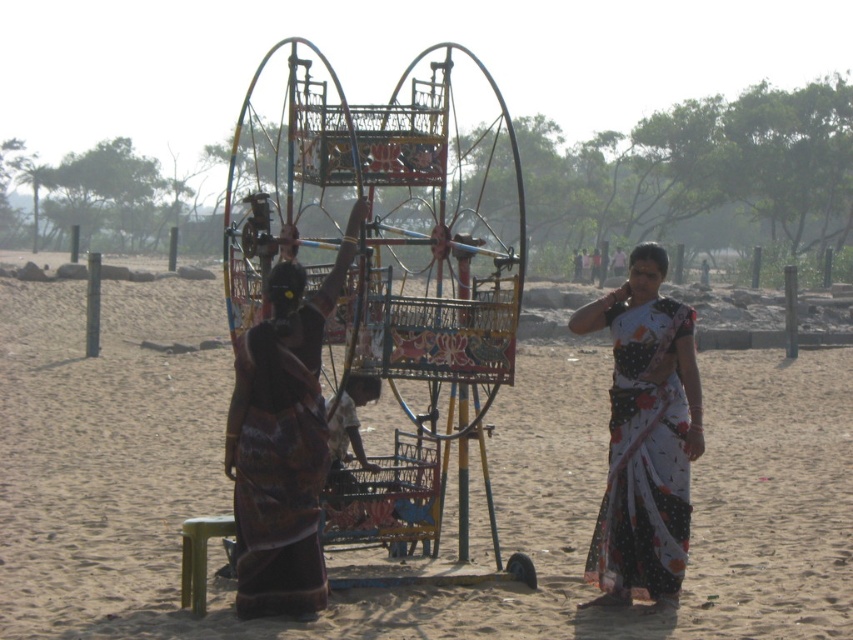
You are a photographer taking a picture of the metallic painted ferris wheel at center and the dark brown fabric saree at center. Which object should you focus on first if you want to capture both in the same frame without moving the camera?

You should focus on the metallic painted ferris wheel at center first because it is above the dark brown fabric saree at center, so it will be in the background and the saree will be in the foreground. By focusing on the background object first, you can ensure both are in focus when using a small aperture or depth of field.

You are a photographer taking a picture of the two women and the chariot. You notice a point marked at coordinates [645,436]. What object is located at this point?

The point at coordinates [645,436] marks the white dotted saree at center.

You are a photographer planning to capture a wide shot of the metallic painted ferris wheel at center and the dark brown fabric saree at center. Based on their sizes, which object should you prioritize positioning closer to the camera to ensure both are visible in the frame?

The metallic painted ferris wheel at center might be wider than the dark brown fabric saree at center, so positioning the ferris wheel closer to the camera would help ensure both fit within the frame.